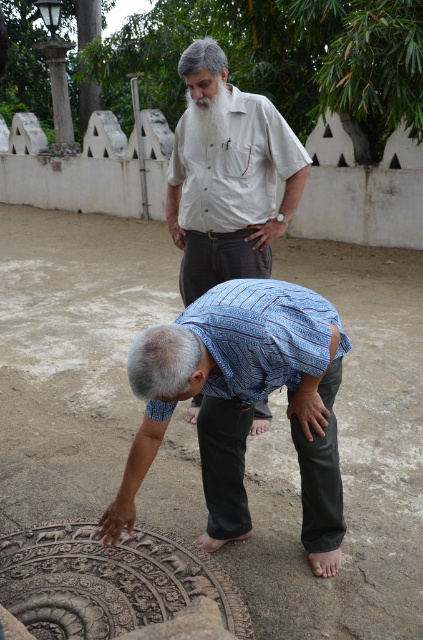
Consider the image. You are a maintenance worker who needs to lift the carved stone manhole cover at lower left and the white fluffy beard at upper center. Which object requires more physical strength to lift?

The carved stone manhole cover at lower left requires more physical strength to lift since it is bigger than the white fluffy beard at upper center.

You are a delivery person with a package that is 1 meter wide. You need to place it on either the carved stone manhole cover at lower left or the light beige cotton shirt at center. Based on their sizes, which surface can accommodate the package?

The carved stone manhole cover at lower left might be wider than the light beige cotton shirt at center, so it is more likely to accommodate the 1 meter wide package.

You are standing in the courtyard and see the carved stone manhole cover at lower left marked by point (346, 461). Can you step on it without moving your feet from their current position?

The carved stone manhole cover at lower left is marked by point (346, 461), so if your feet are already positioned at that point, you can step on it. However, if you need to move to reach that point, you would have to adjust your position first.